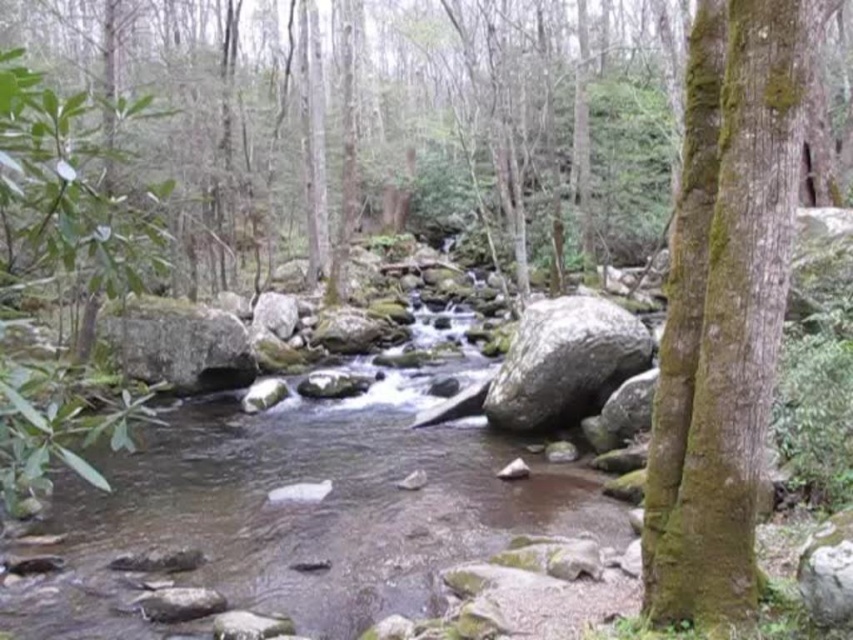
Is clear water at center to the left of green mossy bark tree at right from the viewer's perspective?

Correct, you'll find clear water at center to the left of green mossy bark tree at right.

Can you confirm if clear water at center is taller than green mossy bark tree at right?

Incorrect, clear water at center's height is not larger of green mossy bark tree at right's.

Describe the element at coordinates (297, 515) in the screenshot. I see `clear water at center` at that location.

This screenshot has height=640, width=853. I want to click on clear water at center, so click(297, 515).